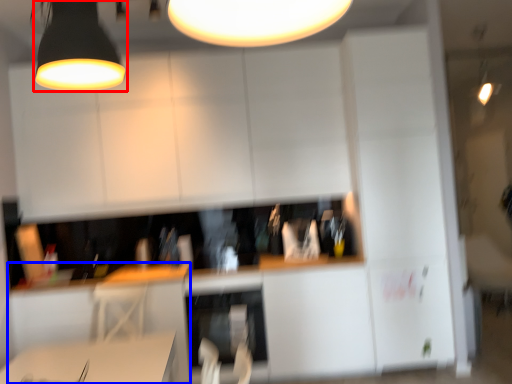
Question: Which object is closer to the camera taking this photo, lamp (highlighted by a red box) or computer desk (highlighted by a blue box)?

Choices:
 (A) lamp
 (B) computer desk

Answer: (A)